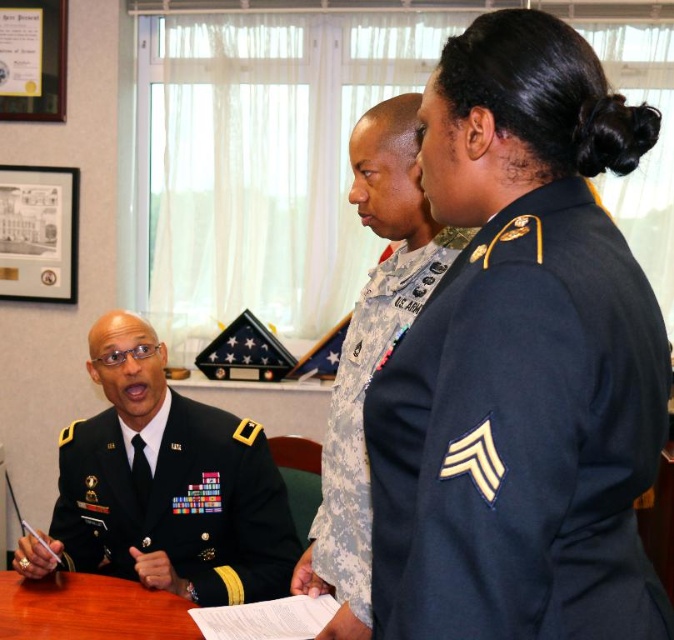
Who is taller, dark green military uniform at left or camouflage fabric uniform at center?

With more height is camouflage fabric uniform at center.

Between dark green military uniform at left and camouflage fabric uniform at center, which one is positioned higher?

camouflage fabric uniform at center

Locate an element on the screen. dark green military uniform at left is located at coordinates (179, 502).

Can you confirm if dark green military uniform at left is shorter than brown wooden table at center?

In fact, dark green military uniform at left may be taller than brown wooden table at center.

How far apart are dark green military uniform at left and brown wooden table at center?

dark green military uniform at left is 9.62 inches from brown wooden table at center.

In order to click on dark green military uniform at left in this screenshot , I will do `click(179, 502)`.

Where is `dark green military uniform at left`? The height and width of the screenshot is (640, 674). dark green military uniform at left is located at coordinates (179, 502).

In the scene shown: Is camouflage fabric uniform at center below brown wooden table at center?

Incorrect, camouflage fabric uniform at center is not positioned below brown wooden table at center.

Is camouflage fabric uniform at center wider than brown wooden table at center?

No.

Does point (388, 275) lie behind point (142, 616)?

No, it is in front of (142, 616).

In order to click on camouflage fabric uniform at center in this screenshot , I will do click(361, 416).